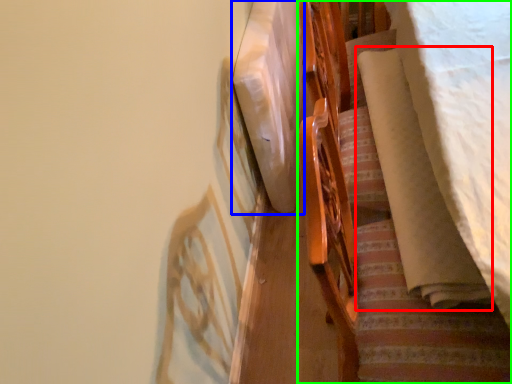
Question: Which object is positioned farthest from blanket (highlighted by a red box)? Select from linen (highlighted by a blue box) and furniture (highlighted by a green box).

Choices:
 (A) linen
 (B) furniture

Answer: (A)